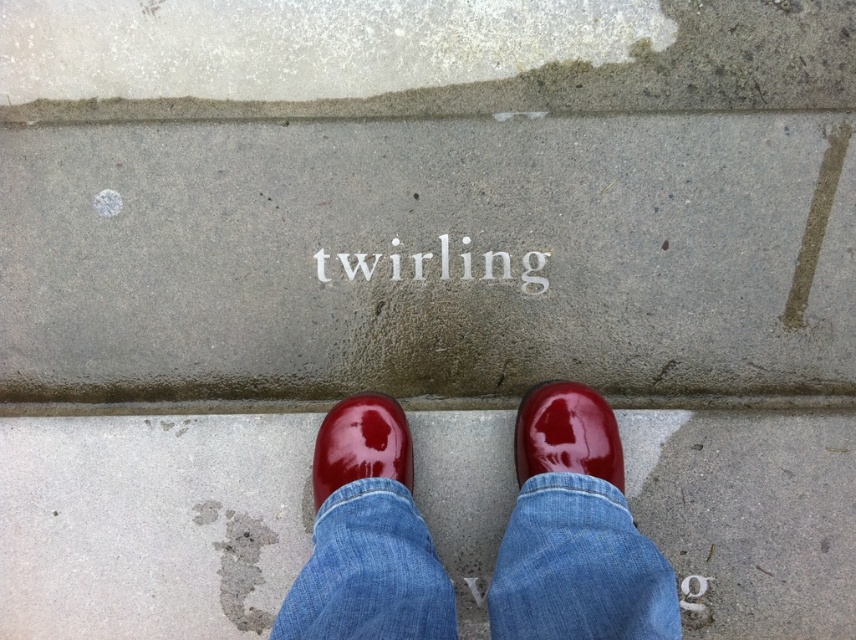
Which is more to the left, blue denim jeans at center or glossy red shoe at center?

glossy red shoe at center is more to the left.

At what (x,y) coordinates should I click in order to perform the action: click on blue denim jeans at center. Please return your answer as a coordinate pair (x, y). Looking at the image, I should click on pos(578,566).

Does glossy red shoes at center have a lesser height compared to blue denim jeans at center?

In fact, glossy red shoes at center may be taller than blue denim jeans at center.

Does glossy red shoes at center appear on the right side of blue denim jeans at center?

No, glossy red shoes at center is not to the right of blue denim jeans at center.

Describe the element at coordinates (150, 524) in the screenshot. I see `glossy red shoes at center` at that location.

Where is `glossy red shoes at center`? The height and width of the screenshot is (640, 856). glossy red shoes at center is located at coordinates (150, 524).

Is gray concrete at center to the right of glossy red shoes at center from the viewer's perspective?

Correct, you'll find gray concrete at center to the right of glossy red shoes at center.

Identify the location of gray concrete at center. The height and width of the screenshot is (640, 856). (428, 257).

Describe the element at coordinates (428, 257) in the screenshot. I see `gray concrete at center` at that location.

What are the coordinates of `gray concrete at center` in the screenshot? It's located at (428, 257).